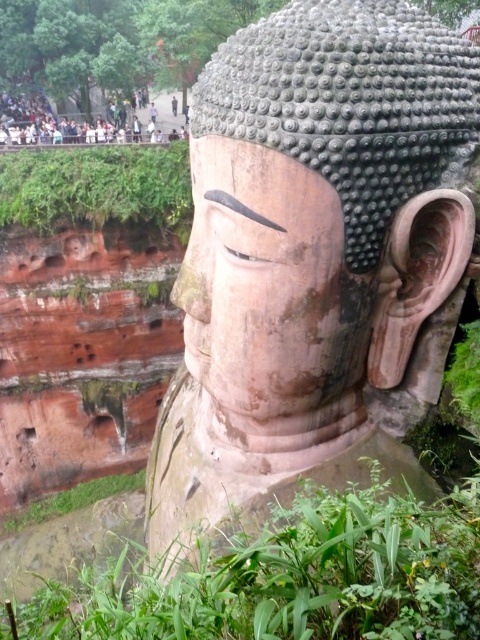
You are standing in front of the Buddha statue and want to place a small offering at the point marked by coordinates point (x=282, y=512). Considering the statue is 7.13 meters away from you, can you estimate if you can reach that point without moving closer than 2 meters to the statue?

The point (x=282, y=512) is 7.13 meters from the viewer. Since the minimum distance allowed is 2 meters, you cannot reach that point without moving closer than 2 meters to the statue.

You are standing in front of the statue of Buddha. There is a point marked at coordinates (313, 257). What does this point correspond to?

The point at coordinates (313, 257) corresponds to the smooth stone statue at center.

You are standing in front of the Buddha statue and want to place two markers. One at point (464, 116) and another at point (188, 198). Which marker will be closer to you?

The marker at point (464, 116) will be closer to you because it is in front of point (188, 198).